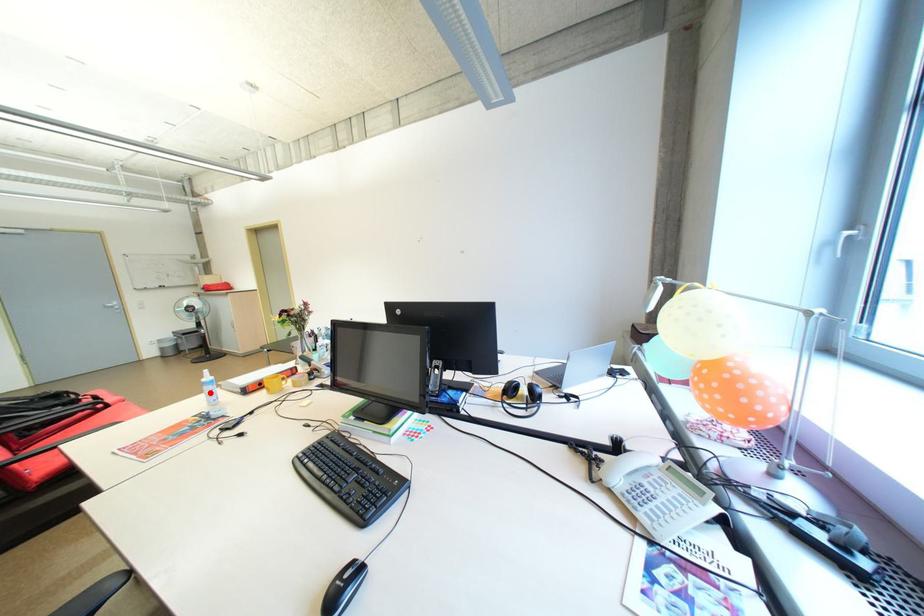
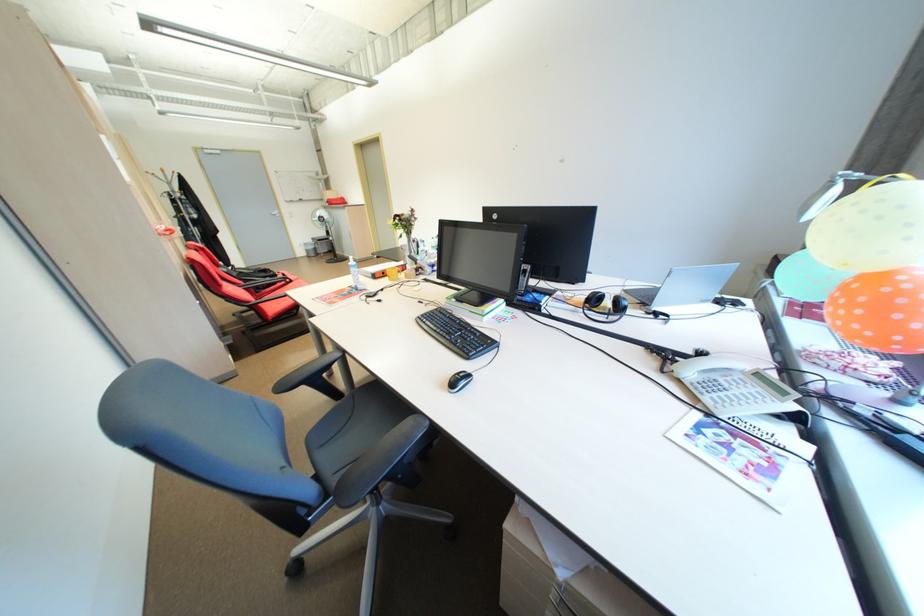
Locate, in the second image, the point that corresponds to the highlighted location in the first image.

(359, 273)